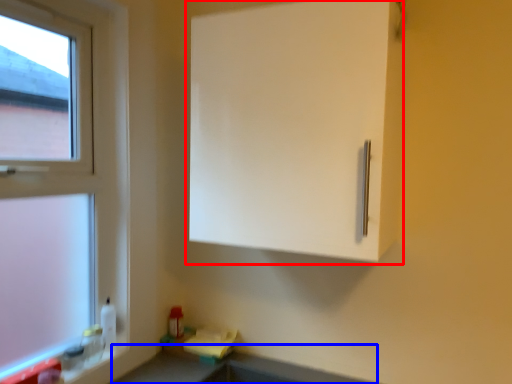
Question: Which object is further to the camera taking this photo, cabinetry (highlighted by a red box) or counter top (highlighted by a blue box)?

Choices:
 (A) cabinetry
 (B) counter top

Answer: (A)